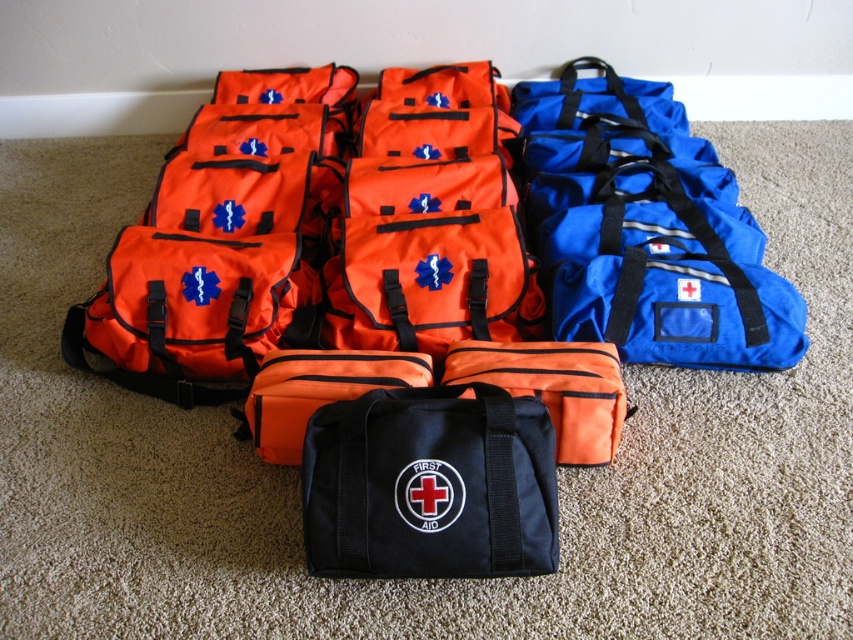
Does orange fabric first aid kit at center appear on the left side of black fabric first aid kit at center?

Incorrect, orange fabric first aid kit at center is not on the left side of black fabric first aid kit at center.

Which is more to the right, orange fabric first aid kit at center or black fabric first aid kit at center?

From the viewer's perspective, orange fabric first aid kit at center appears more on the right side.

Is point (199, 264) positioned in front of point (316, 490)?

No, (199, 264) is behind (316, 490).

Where is `orange fabric first aid kit at center`? The image size is (853, 640). orange fabric first aid kit at center is located at coordinates (404, 490).